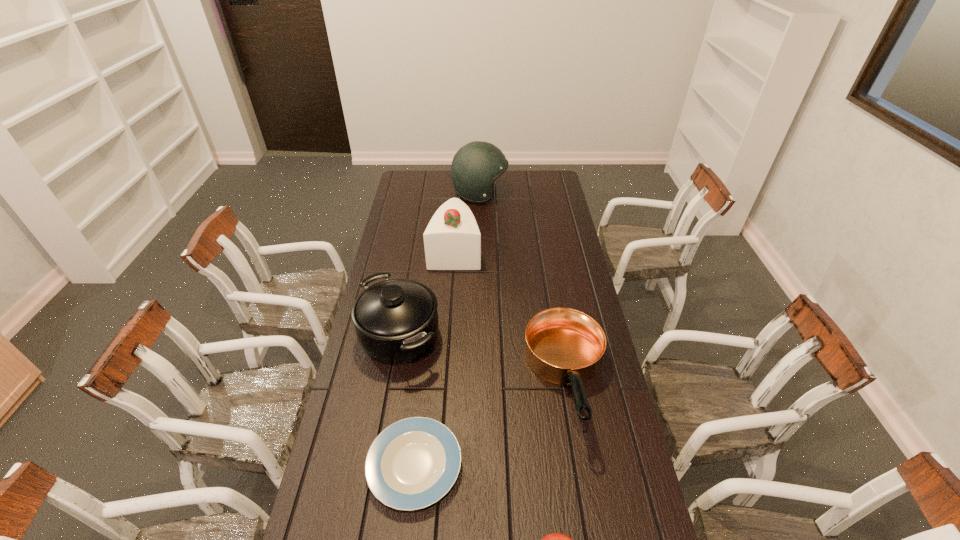
I want to click on empty location between the shortest object and the cake, so click(435, 358).

The height and width of the screenshot is (540, 960). What are the coordinates of `free space that is in between the cake and the fourth tallest object` in the screenshot? It's located at tap(511, 315).

You are a GUI agent. You are given a task and a screenshot of the screen. Output one action in this format:
    pyautogui.click(x=<x>, y=<y>)
    Task: Click on the free space between the plate and the fourth shortest object
    The width and height of the screenshot is (960, 540).
    Given the screenshot: What is the action you would take?
    pyautogui.click(x=407, y=401)

The image size is (960, 540). Identify the location of free space between the cake and the fourth tallest object. (511, 315).

Find the location of a particular element. Image resolution: width=960 pixels, height=540 pixels. object that stands as the fifth closest to the fourth shortest object is located at coordinates (475, 167).

This screenshot has height=540, width=960. What are the coordinates of `object that is the third closest to the fourth tallest object` in the screenshot? It's located at (396, 321).